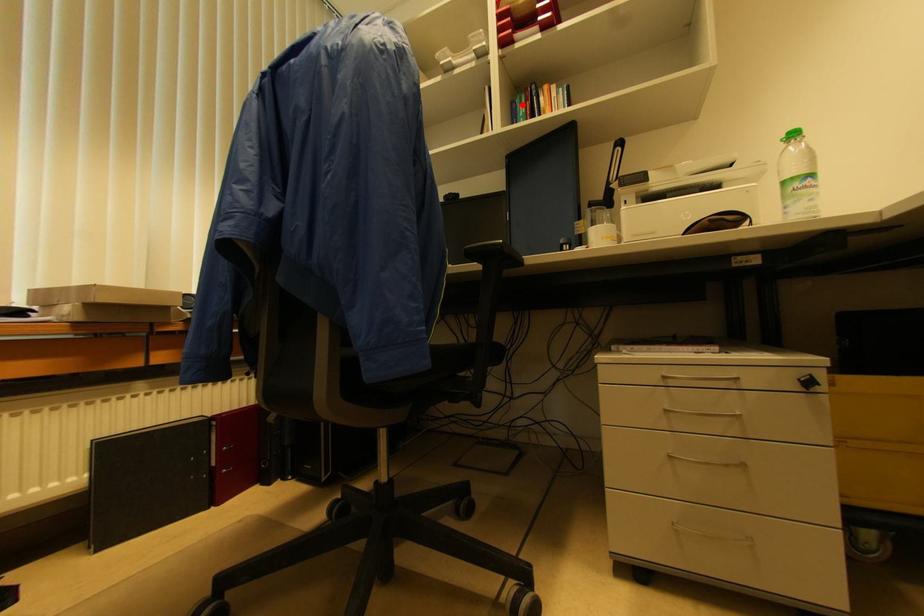
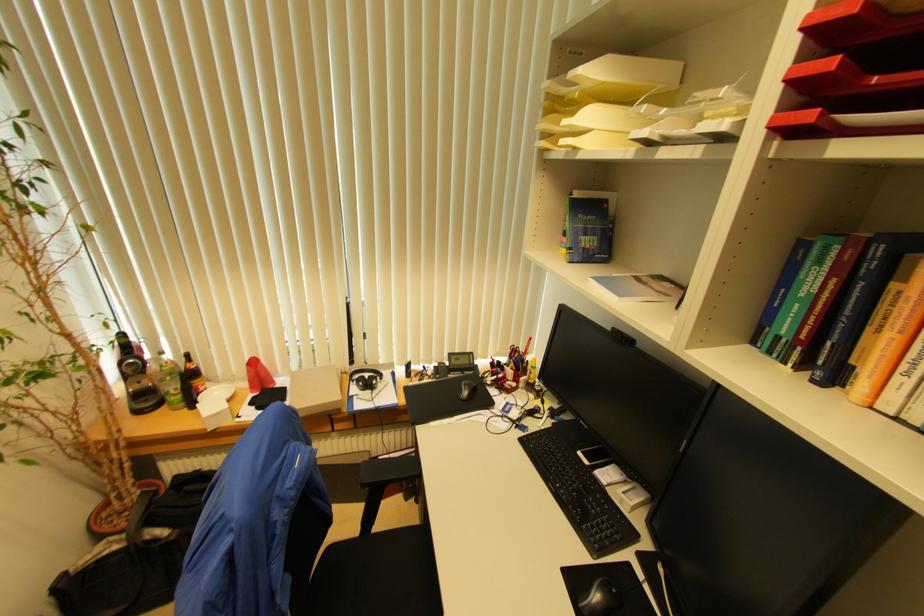
In the second image, find the point that corresponds to the highlighted location in the first image.

(821, 265)